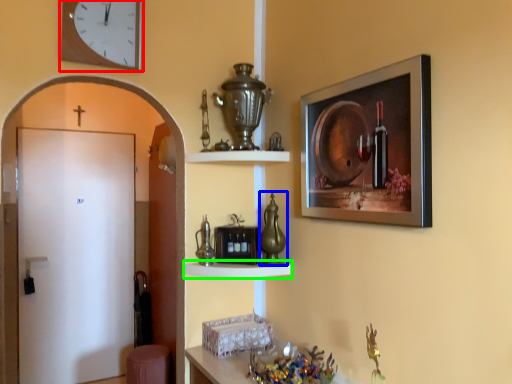
Question: Considering the real-world distances, which object is farthest from clock (highlighted by a red box)? glass vase (highlighted by a blue box) or shelf (highlighted by a green box)?

Choices:
 (A) glass vase
 (B) shelf

Answer: (B)